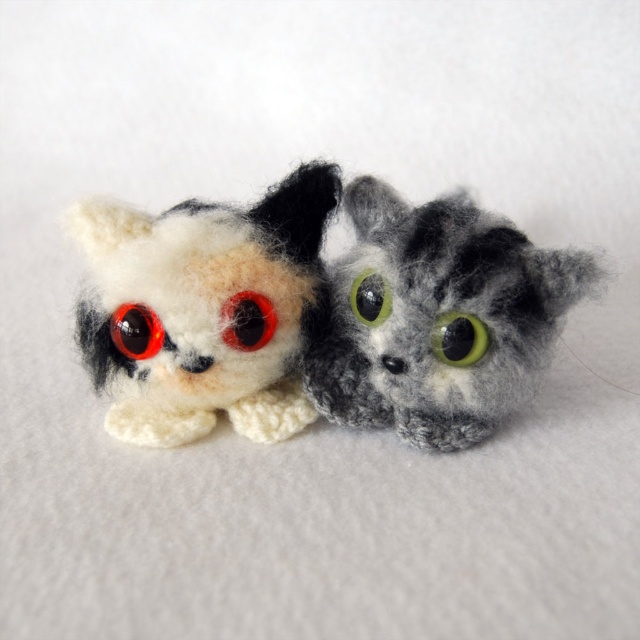
Which is more to the right, white woolen cat at left or fluffy gray cat at center?

From the viewer's perspective, fluffy gray cat at center appears more on the right side.

Is white woolen cat at left thinner than fluffy gray cat at center?

Yes, white woolen cat at left is thinner than fluffy gray cat at center.

I want to click on white woolen cat at left, so click(x=204, y=307).

Where is `white woolen cat at left`? The width and height of the screenshot is (640, 640). white woolen cat at left is located at coordinates (204, 307).

Is white woolen cat at left thinner than matte red eye at left?

In fact, white woolen cat at left might be wider than matte red eye at left.

Is point (179, 401) farther from camera compared to point (161, 333)?

Yes, point (179, 401) is behind point (161, 333).

Identify the location of white woolen cat at left. This screenshot has width=640, height=640. (204, 307).

Can you confirm if fluffy gray cat at center is positioned to the left of red felt eye at center?

Incorrect, fluffy gray cat at center is not on the left side of red felt eye at center.

Does point (333, 360) come closer to viewer compared to point (272, 317)?

No, it is behind (272, 317).

Is point (515, 403) farther from viewer compared to point (225, 339)?

Yes.

The width and height of the screenshot is (640, 640). Identify the location of fluffy gray cat at center. (436, 317).